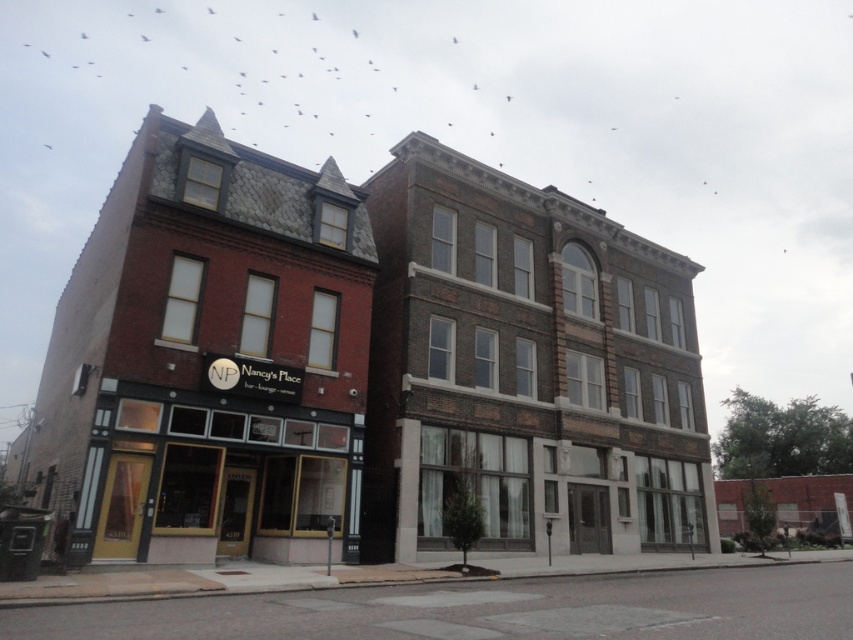
Does point (416, 332) come in front of point (292, 417)?

That is False.

I want to click on brick building at center, so [363, 364].